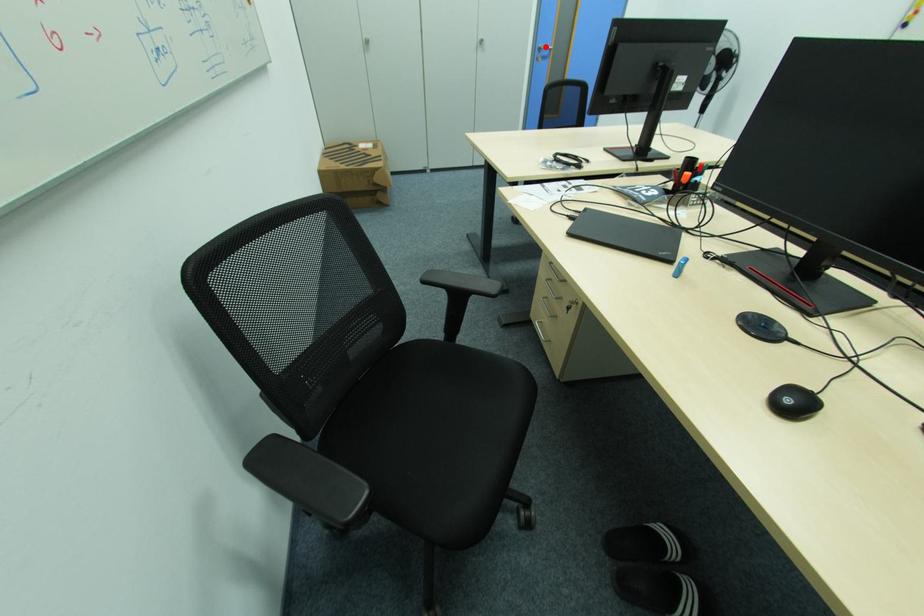
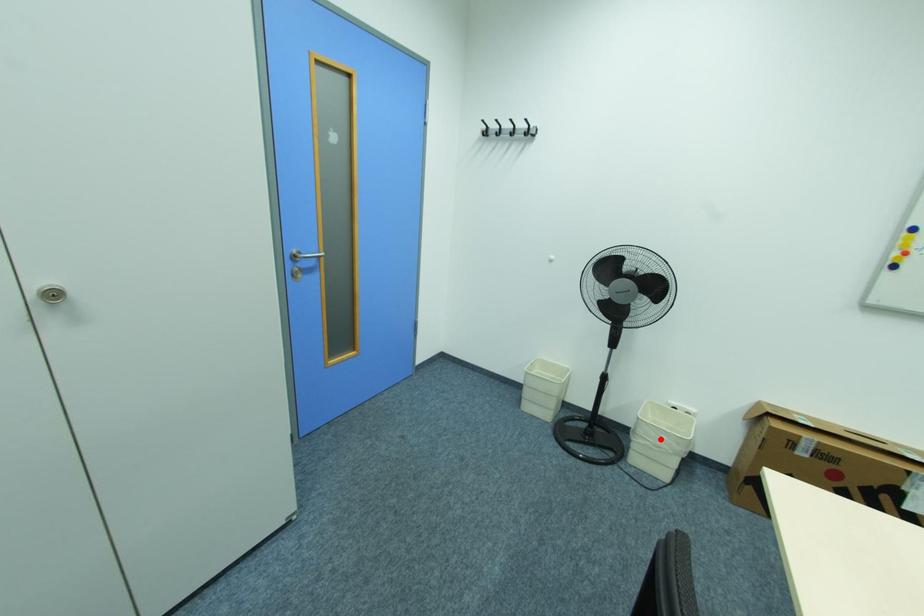
I am providing you with two images of the same scene from different viewpoints. A red point is marked on the first image and another point is marked on the second image. Does the point marked in image1 correspond to the same location as the one in image2?

No